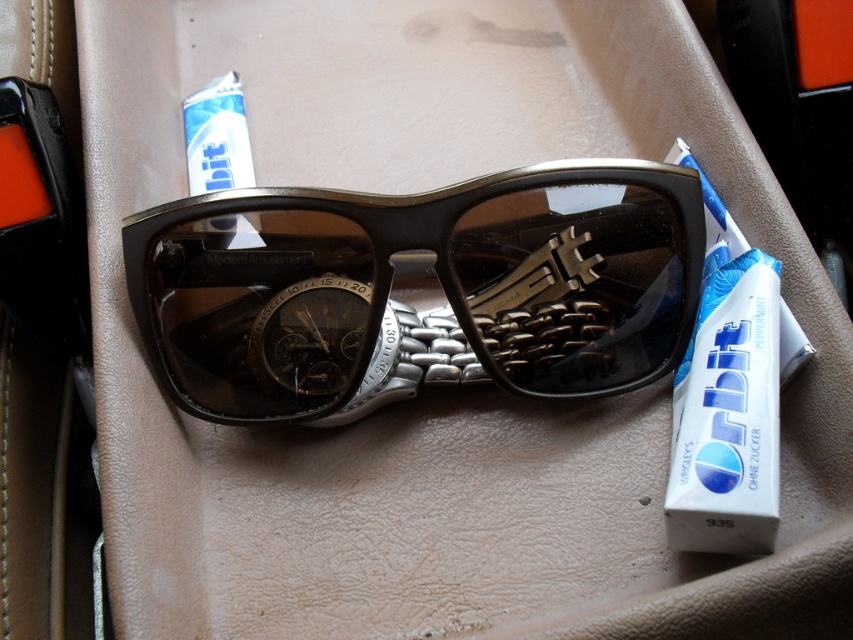
You are looking at the image of sunglasses on a tan leather surface. There is a point marked at coordinates [419,289]. What object is located at that point?

The point at coordinates 0.492 indicates the location of the matte black sunglasses at center.

You are a dentist examining a patient who has a white glossy toothpaste at right and a white glossy tube at upper center. Which one is positioned lower in the scene?

The white glossy toothpaste at right is positioned below the white glossy tube at upper center, so it is lower in the scene.